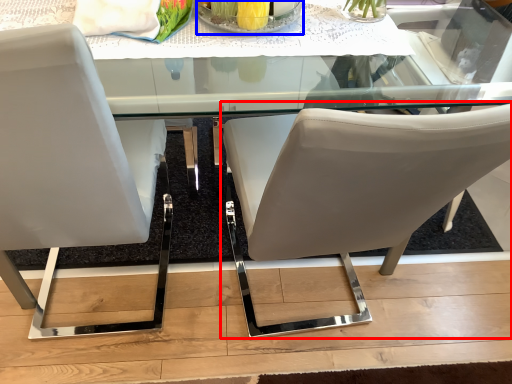
Question: Which of the following is the closest to the observer, chair (highlighted by a red box) or glass plate (highlighted by a blue box)?

Choices:
 (A) chair
 (B) glass plate

Answer: (A)